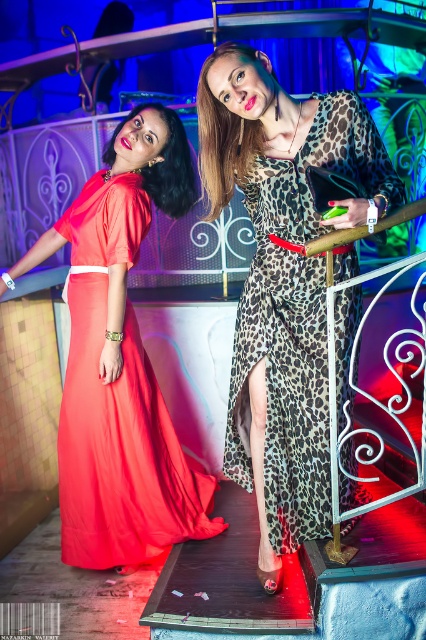
In the scene shown: You are standing at the base of the staircase in the image and want to reach the upper landing. You notice two points marked on the image. Which point, point (x=287, y=488) or point (x=160, y=202), is closer to you?

Point (x=160, y=202) is closer to you because it is behind point (x=287, y=488), which is in front of it.

You are standing in front of the staircase scene. There are two points marked in the image. The first point is at coordinate point (127, 227) and the second point is at coordinate point (164, 200). If you were to walk towards the staircase, which point would you reach first?

Point (127, 227) is closer to the viewer than point (164, 200), so you would reach point (127, 227) first.

You are a fashion designer observing two dresses in the image. The leopard print fabric dress at center and the matte red dress at upper left. Which dress is bigger in size?

The leopard print fabric dress at center has a larger size compared to the matte red dress at upper left, so the leopard print fabric dress at center is bigger in size.